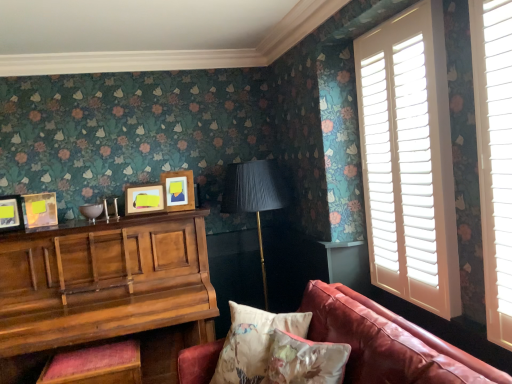
This screenshot has width=512, height=384. In order to click on white painted wood shutters at right in this screenshot , I will do `click(409, 159)`.

Describe the element at coordinates (106, 290) in the screenshot. I see `wooden piano at left` at that location.

I want to click on matte wooden picture frame at left, which is the first picture frame from left to right, so click(x=11, y=213).

Which of these two, matte wooden picture frame at upper center, marked as the 2th picture frame in a right-to-left arrangement, or matte wooden picture frame at left, arranged as the 4th picture frame when viewed from the right, is smaller?

matte wooden picture frame at left, arranged as the 4th picture frame when viewed from the right, is smaller.

Locate an element on the screen. the 2nd picture frame in front of the matte wooden picture frame at upper center, positioned as the 3th picture frame in left-to-right order is located at coordinates (11, 213).

Which object is further away from the camera, matte wooden picture frame at upper center, marked as the 2th picture frame in a right-to-left arrangement, or matte wooden picture frame at left, arranged as the 4th picture frame when viewed from the right?

matte wooden picture frame at upper center, marked as the 2th picture frame in a right-to-left arrangement, is behind.

From a real-world perspective, which is physically above, matte wooden picture frame at upper center, marked as the 2th picture frame in a right-to-left arrangement, or matte wooden picture frame at left, arranged as the 4th picture frame when viewed from the right?

matte wooden picture frame at upper center, marked as the 2th picture frame in a right-to-left arrangement, from a real-world perspective.

Which object is positioned more to the left, velvet red music stool at lower left or matte wooden picture frame at center, which appears as the first picture frame when viewed from the right?

From the viewer's perspective, velvet red music stool at lower left appears more on the left side.

From the image's perspective, does velvet red music stool at lower left appear lower than matte wooden picture frame at center, which appears as the first picture frame when viewed from the right?

Yes, from the image's perspective, velvet red music stool at lower left is beneath matte wooden picture frame at center, which appears as the first picture frame when viewed from the right.

Consider the image. Who is smaller, velvet red music stool at lower left or matte wooden picture frame at center, positioned as the 4th picture frame in left-to-right order?

matte wooden picture frame at center, positioned as the 4th picture frame in left-to-right order, is smaller.

Can you tell me how much floral fabric cushion at lower center and matte wooden picture frame at center, which appears as the first picture frame when viewed from the right, differ in facing direction?

The facing directions of floral fabric cushion at lower center and matte wooden picture frame at center, which appears as the first picture frame when viewed from the right, are 29.9 degrees apart.

The image size is (512, 384). Find the location of `pillow below the matte wooden picture frame at center, which appears as the first picture frame when viewed from the right (from the image's perspective)`. pillow below the matte wooden picture frame at center, which appears as the first picture frame when viewed from the right (from the image's perspective) is located at coordinates (253, 342).

Which point is more forward, [228,367] or [167,204]?

The point [228,367] is closer to the camera.

Is floral fabric cushion at lower center bigger than matte wooden picture frame at center, which appears as the first picture frame when viewed from the right?

Yes, floral fabric cushion at lower center is bigger than matte wooden picture frame at center, which appears as the first picture frame when viewed from the right.

Does matte wooden picture frame at left, which is the first picture frame from left to right, turn towards floral fabric cushion at lower center?

No, matte wooden picture frame at left, which is the first picture frame from left to right, is not turned towards floral fabric cushion at lower center.

From the image's perspective, which is below, matte wooden picture frame at left, arranged as the 4th picture frame when viewed from the right, or floral fabric cushion at lower center?

floral fabric cushion at lower center is shown below in the image.

From the picture: Is matte wooden picture frame at left, which is the first picture frame from left to right, smaller than floral fabric cushion at lower center?

Correct, matte wooden picture frame at left, which is the first picture frame from left to right, occupies less space than floral fabric cushion at lower center.

Considering the relative positions of matte wooden picture frame at left, which is the first picture frame from left to right, and floral fabric cushion at lower center in the image provided, is matte wooden picture frame at left, which is the first picture frame from left to right, to the right of floral fabric cushion at lower center from the viewer's perspective?

In fact, matte wooden picture frame at left, which is the first picture frame from left to right, is to the left of floral fabric cushion at lower center.

Which of these two, matte wooden picture frame at upper center, positioned as the 3th picture frame in left-to-right order, or leather couch at lower right, is thinner?

matte wooden picture frame at upper center, positioned as the 3th picture frame in left-to-right order, is thinner.

Considering the relative sizes of matte wooden picture frame at upper center, positioned as the 3th picture frame in left-to-right order, and leather couch at lower right in the image provided, is matte wooden picture frame at upper center, positioned as the 3th picture frame in left-to-right order, shorter than leather couch at lower right?

Yes, matte wooden picture frame at upper center, positioned as the 3th picture frame in left-to-right order, is shorter than leather couch at lower right.

In the scene shown: Considering the sizes of objects matte wooden picture frame at upper center, marked as the 2th picture frame in a right-to-left arrangement, and leather couch at lower right in the image provided, who is smaller, matte wooden picture frame at upper center, marked as the 2th picture frame in a right-to-left arrangement, or leather couch at lower right?

matte wooden picture frame at upper center, marked as the 2th picture frame in a right-to-left arrangement, is smaller.

Is matte wooden picture frame at upper center, positioned as the 3th picture frame in left-to-right order, not near leather couch at lower right?

Yes.

Considering the positions of objects matte wooden picture frame at center, positioned as the 4th picture frame in left-to-right order, and matte yellow picture frame at left, the 2th picture frame when ordered from left to right, in the image provided, who is more to the left, matte wooden picture frame at center, positioned as the 4th picture frame in left-to-right order, or matte yellow picture frame at left, the 2th picture frame when ordered from left to right,?

From the viewer's perspective, matte yellow picture frame at left, the 2th picture frame when ordered from left to right, appears more on the left side.

There is a matte yellow picture frame at left, the 3th picture frame viewed from the right. Where is `the 2nd picture frame above it (from the image's perspective)`? the 2nd picture frame above it (from the image's perspective) is located at coordinates (178, 190).

From a real-world perspective, between matte wooden picture frame at center, positioned as the 4th picture frame in left-to-right order, and matte yellow picture frame at left, the 2th picture frame when ordered from left to right, who is vertically higher?

matte wooden picture frame at center, positioned as the 4th picture frame in left-to-right order.

Consider the image. Is matte wooden picture frame at center, positioned as the 4th picture frame in left-to-right order, not within matte yellow picture frame at left, the 2th picture frame when ordered from left to right?

matte wooden picture frame at center, positioned as the 4th picture frame in left-to-right order, lies outside matte yellow picture frame at left, the 2th picture frame when ordered from left to right,'s area.

Is matte wooden picture frame at upper center, positioned as the 3th picture frame in left-to-right order, positioned beyond the bounds of wooden piano at left?

Yes, matte wooden picture frame at upper center, positioned as the 3th picture frame in left-to-right order, is outside of wooden piano at left.

Based on the photo, does matte wooden picture frame at upper center, positioned as the 3th picture frame in left-to-right order, have a greater width compared to wooden piano at left?

Incorrect, the width of matte wooden picture frame at upper center, positioned as the 3th picture frame in left-to-right order, does not surpass that of wooden piano at left.

Visually, is matte wooden picture frame at upper center, marked as the 2th picture frame in a right-to-left arrangement, positioned to the left or to the right of wooden piano at left?

Based on their positions, matte wooden picture frame at upper center, marked as the 2th picture frame in a right-to-left arrangement, is located to the right of wooden piano at left.

From a real-world perspective, between matte wooden picture frame at upper center, positioned as the 3th picture frame in left-to-right order, and wooden piano at left, who is vertically lower?

wooden piano at left.

Starting from the matte wooden picture frame at left, arranged as the 4th picture frame when viewed from the right, which picture frame is the 2nd one behind? Please provide its 2D coordinates.

[(144, 199)]

Where is `the 2nd picture frame to the right of the velvet red music stool at lower left, counting from the anchor's position`? The width and height of the screenshot is (512, 384). the 2nd picture frame to the right of the velvet red music stool at lower left, counting from the anchor's position is located at coordinates (178, 190).

When comparing their distances from wooden piano at left, does velvet red music stool at lower left or matte yellow picture frame at left, the 3th picture frame viewed from the right, seem closer?

velvet red music stool at lower left is closer to wooden piano at left.

Looking at this image, when comparing their distances from floral fabric cushion at lower center, does matte wooden picture frame at center, which appears as the first picture frame when viewed from the right, or white painted wood shutters at right seem closer?

white painted wood shutters at right is closer to floral fabric cushion at lower center.

Estimate the real-world distances between objects in this image. Which object is closer to wooden piano at left, matte wooden picture frame at upper center, positioned as the 3th picture frame in left-to-right order, or leather couch at lower right?

matte wooden picture frame at upper center, positioned as the 3th picture frame in left-to-right order, is positioned closer to the anchor wooden piano at left.

Consider the image. Looking at the image, which one is located closer to floral fabric cushion at lower center, leather couch at lower right or wooden piano at left?

Among the two, leather couch at lower right is located nearer to floral fabric cushion at lower center.

Considering their positions, is matte wooden picture frame at upper center, marked as the 2th picture frame in a right-to-left arrangement, positioned further to matte wooden picture frame at center, positioned as the 4th picture frame in left-to-right order, than matte yellow picture frame at left, the 2th picture frame when ordered from left to right?

matte yellow picture frame at left, the 2th picture frame when ordered from left to right, lies further to matte wooden picture frame at center, positioned as the 4th picture frame in left-to-right order, than the other object.

When comparing their distances from floral fabric cushion at lower center, does black pleated fabric at center or white painted wood shutters at right seem closer?

white painted wood shutters at right is positioned closer to the anchor floral fabric cushion at lower center.

From the picture: Based on their spatial positions, is matte yellow picture frame at left, the 3th picture frame viewed from the right, or white painted wood shutters at right closer to wooden piano at left?

Based on the image, matte yellow picture frame at left, the 3th picture frame viewed from the right, appears to be nearer to wooden piano at left.

From the image, which object appears to be farther from black pleated fabric at center, leather couch at lower right or floral fabric cushion at lower center?

leather couch at lower right is positioned further to the anchor black pleated fabric at center.

Locate an element on the screen. The image size is (512, 384). table located between matte wooden picture frame at left, which is the first picture frame from left to right, and leather couch at lower right in the left-right direction is located at coordinates (106, 290).

The image size is (512, 384). In order to click on pillow between leather couch at lower right and matte wooden picture frame at center, positioned as the 4th picture frame in left-to-right order, in the front-back direction in this screenshot , I will do `click(253, 342)`.

Locate an element on the screen. table between matte wooden picture frame at left, arranged as the 4th picture frame when viewed from the right, and black pleated fabric at center, in the horizontal direction is located at coordinates (106, 290).

Where is `picture frame between matte yellow picture frame at left, the 3th picture frame viewed from the right, and velvet red music stool at lower left, in the vertical direction`? Image resolution: width=512 pixels, height=384 pixels. picture frame between matte yellow picture frame at left, the 3th picture frame viewed from the right, and velvet red music stool at lower left, in the vertical direction is located at coordinates (11, 213).